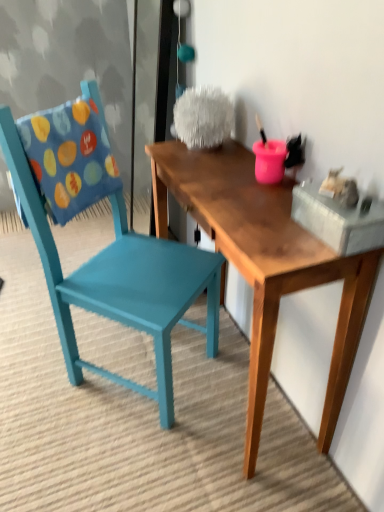
What are the coordinates of `vacant area on top of wooden table at center (from a real-world perspective)` in the screenshot? It's located at (235, 181).